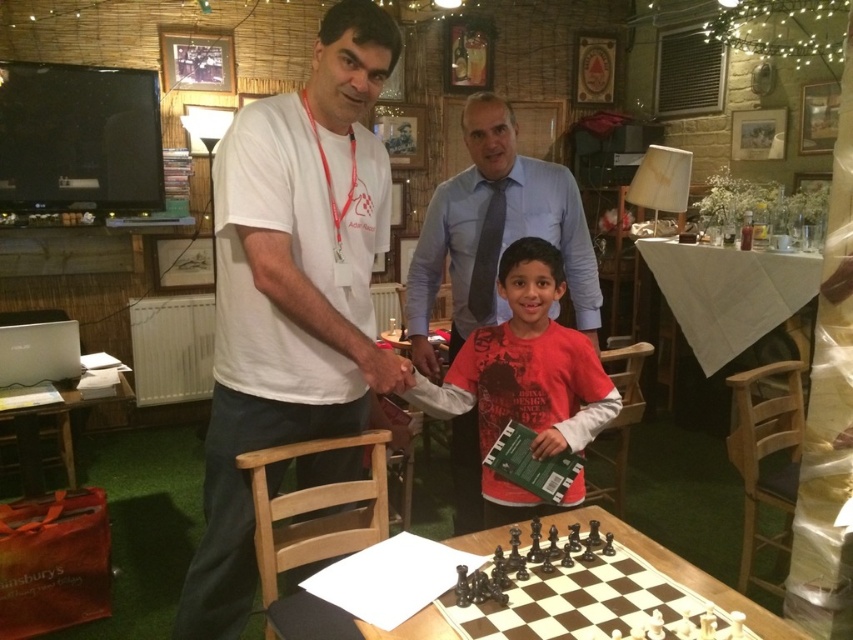
Is point (573, 444) positioned behind point (53, 413)?

That is False.

Which is behind, point (549, 428) or point (64, 410)?

Point (64, 410)

Where is `red cotton shirt at center`? red cotton shirt at center is located at coordinates (525, 380).

Between wooden chessboard at center and wooden table at lower left, which one has less height?

Standing shorter between the two is wooden chessboard at center.

Image resolution: width=853 pixels, height=640 pixels. What are the coordinates of `wooden chessboard at center` in the screenshot? It's located at (680, 570).

Can you confirm if red cotton shirt at center is wider than wooden chessboard at center?

In fact, red cotton shirt at center might be narrower than wooden chessboard at center.

Image resolution: width=853 pixels, height=640 pixels. Describe the element at coordinates (525, 380) in the screenshot. I see `red cotton shirt at center` at that location.

What are the coordinates of `red cotton shirt at center` in the screenshot? It's located at (525, 380).